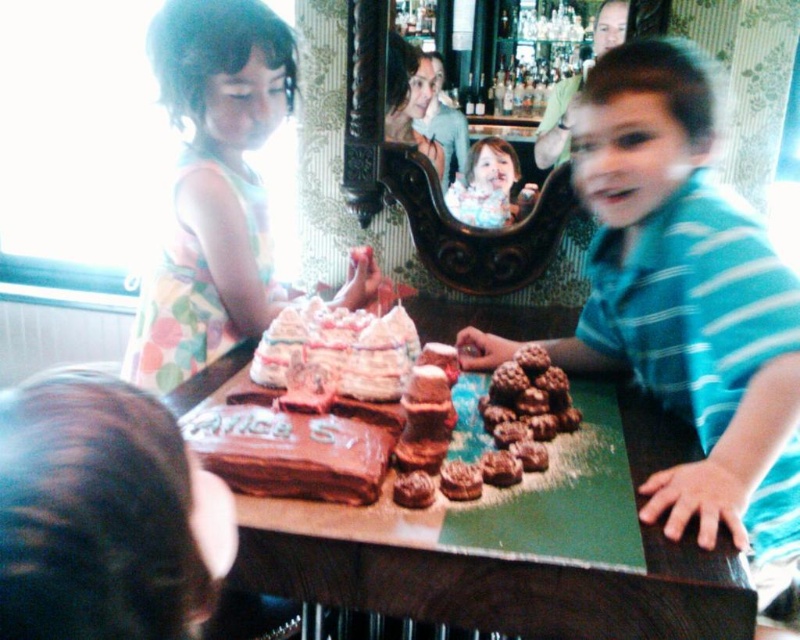
You are a guest at the birthday party and want to place a small gift on the table. Given that the brown cardboard table at center is larger than the chocolate textured cookie at center, will there be enough space on the table to place your gift?

The brown cardboard table at center is larger in size than the chocolate textured cookie at center, so there should be sufficient space to place your small gift on the table.

You are standing at the center of the room and see two points marked on the wall. The first point is at coordinate point(602, 536) and the second is at point(448, 461). Which point is closer to you?

Point(602, 536) is in front of point(448, 461), so it is closer to you.

You are a photographer at the birthday party and want to take a closeup shot of the matte brown cookies at right and the pastel floral dress at left. Which object should you focus on first to ensure it appears sharp in the photo?

The matte brown cookies at right should be focused on first since it is closer to the viewer than the pastel floral dress at left, ensuring sharpness when focusing on the nearest subject first.